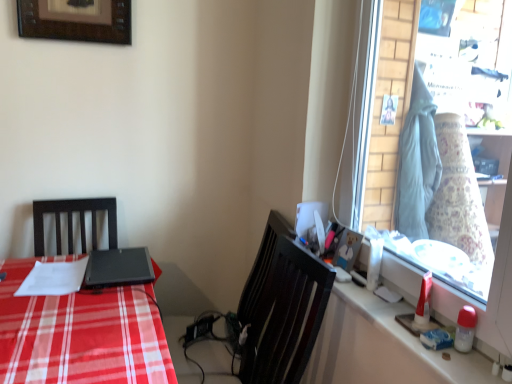
You are a GUI agent. You are given a task and a screenshot of the screen. Output one action in this format:
    pyautogui.click(x=<x>, y=<y>)
    Task: Click on the vacant region in front of matte plastic picture frame at upper right, the 2th picture frame viewed from the left
    
    Given the screenshot: What is the action you would take?
    pyautogui.click(x=361, y=293)